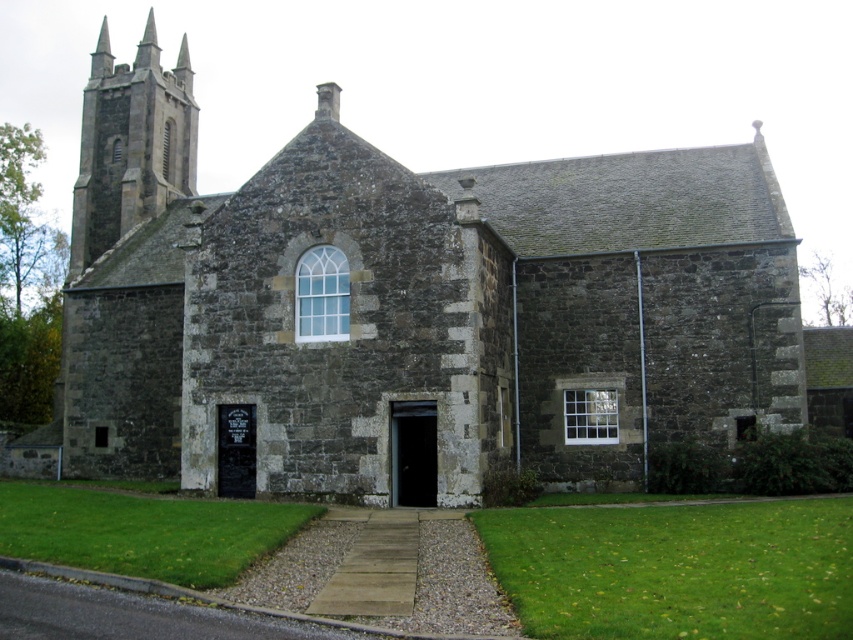
Question: Is dark gray stone church at center positioned at the back of dark gray stone spire at upper left?

Choices:
 (A) yes
 (B) no

Answer: (B)

Question: Which point is farther to the camera?

Choices:
 (A) dark gray stone church at center
 (B) dark gray stone spire at upper left

Answer: (B)

Question: Does dark gray stone church at center have a smaller size compared to dark gray stone spire at upper left?

Choices:
 (A) yes
 (B) no

Answer: (B)

Question: Does dark gray stone church at center have a greater width compared to dark gray stone spire at upper left?

Choices:
 (A) no
 (B) yes

Answer: (B)